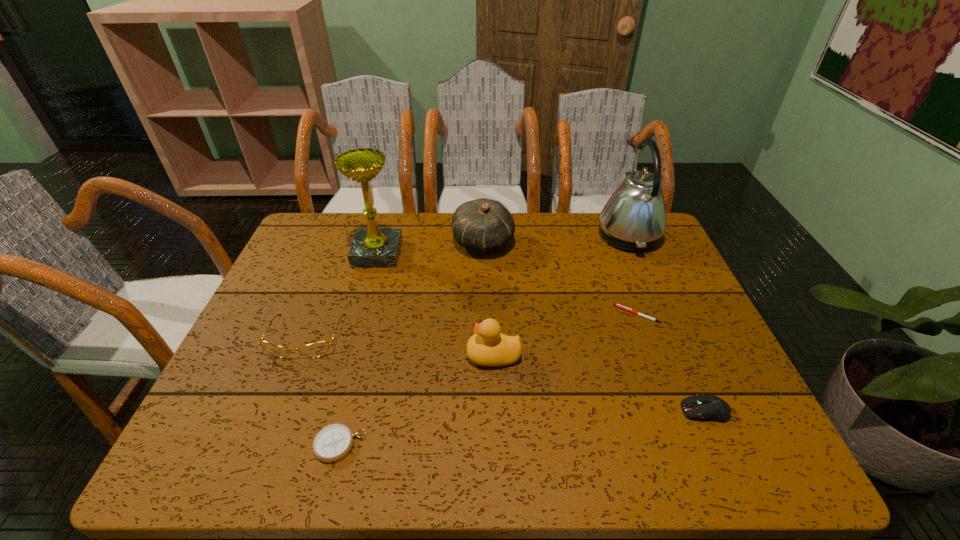
I want to click on vacant region located 0.280m from the spout of the kettle, so click(x=506, y=235).

This screenshot has height=540, width=960. In order to click on free space located from the spout of the kettle in this screenshot , I will do `click(484, 235)`.

The image size is (960, 540). Identify the location of free point located 0.340m from the spout of the kettle. (487, 235).

Where is `vacant space located on the front-facing side of the award`? The image size is (960, 540). vacant space located on the front-facing side of the award is located at coordinates [535, 253].

Where is `vacant space located 0.170m on the front of the gourd`? vacant space located 0.170m on the front of the gourd is located at coordinates (484, 303).

What are the coordinates of `vacant space located 0.080m on the face of the duck` in the screenshot? It's located at (432, 355).

I want to click on vacant space located 0.220m on the face of the duck, so click(x=372, y=355).

Locate an element on the screen. The image size is (960, 540). free space located on the face of the duck is located at coordinates (406, 355).

The width and height of the screenshot is (960, 540). In order to click on vacant space located 0.200m on the front-facing side of the fourth shortest object in this screenshot , I will do `click(265, 441)`.

I want to click on free space located on the button of the computer equipment, so click(657, 411).